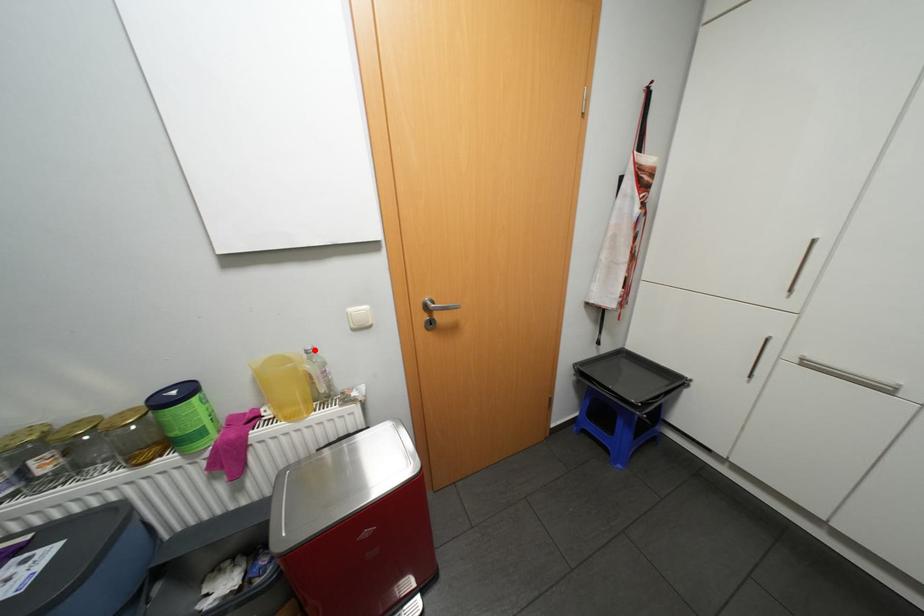
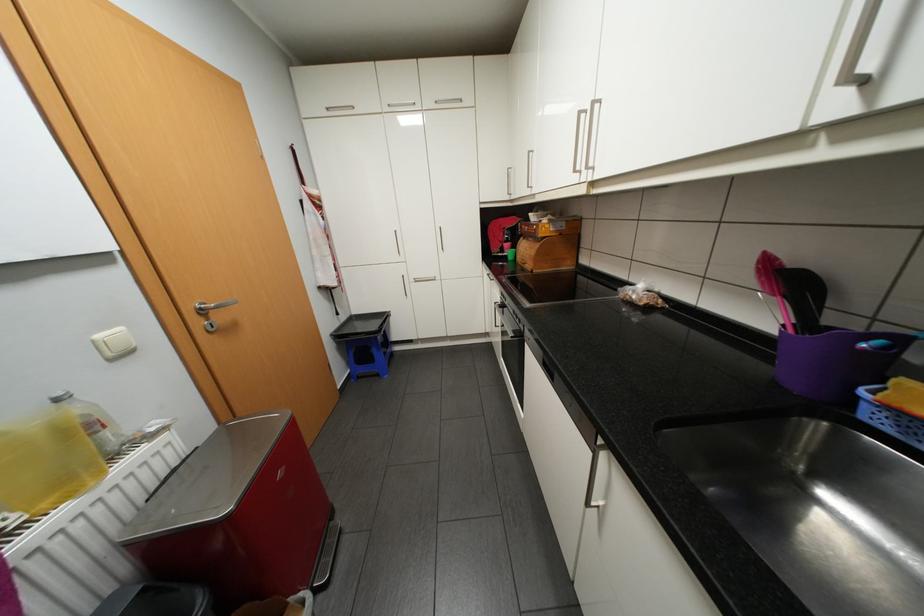
Question: I am providing you with two images of the same scene from different viewpoints. A red point is marked on the first image. Can you still see the location of the red point in image 2?

Choices:
 (A) Yes
 (B) No

Answer: (A)